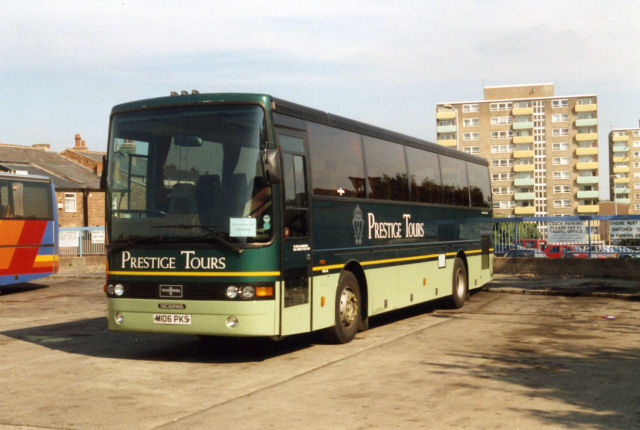
Locate an element on the screen. The image size is (640, 430). chimney is located at coordinates click(77, 138).